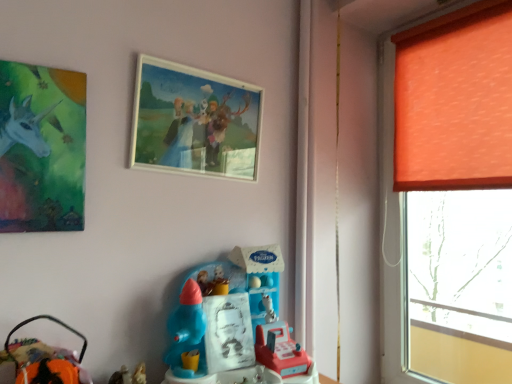
Consider the image. How much space does plastic toy at center, placed as the second toy when sorted from left to right, occupy vertically?

It is 15.65 inches.

This screenshot has height=384, width=512. What do you see at coordinates (42, 148) in the screenshot? I see `matte green painting at upper left, placed as the 1th picture frame when sorted from front to back` at bounding box center [42, 148].

You are a GUI agent. You are given a task and a screenshot of the screen. Output one action in this format:
    pyautogui.click(x=<x>, y=<y>)
    Task: Click on the velvet orange plush at lower left, which appears as the 1th toy when viewed from the left
    The height and width of the screenshot is (384, 512).
    Given the screenshot: What is the action you would take?
    pyautogui.click(x=42, y=359)

The width and height of the screenshot is (512, 384). Describe the element at coordinates (42, 359) in the screenshot. I see `velvet orange plush at lower left, which appears as the 1th toy when viewed from the left` at that location.

Describe the element at coordinates (195, 121) in the screenshot. This screenshot has height=384, width=512. I see `wooden picture frame at upper center, placed as the first picture frame when sorted from right to left` at that location.

This screenshot has height=384, width=512. Describe the element at coordinates (455, 101) in the screenshot. I see `orange fabric curtain at right` at that location.

In order to click on plastic toy at center, placed as the second toy when sorted from left to right in this screenshot , I will do `click(236, 325)`.

From the image's perspective, which is below, orange fabric window at right or plastic toy at center, marked as the 1th toy in a right-to-left arrangement?

plastic toy at center, marked as the 1th toy in a right-to-left arrangement, is shown below in the image.

Considering the relative sizes of orange fabric window at right and plastic toy at center, placed as the second toy when sorted from left to right, in the image provided, is orange fabric window at right shorter than plastic toy at center, placed as the second toy when sorted from left to right,?

No, orange fabric window at right is not shorter than plastic toy at center, placed as the second toy when sorted from left to right.

Is plastic toy at center, placed as the second toy when sorted from left to right, inside orange fabric window at right?

Actually, plastic toy at center, placed as the second toy when sorted from left to right, is outside orange fabric window at right.

Does point (424, 304) come behind point (253, 336)?

Yes.

From the picture: Is matte green painting at upper left, which is counted as the 2th picture frame, starting from the right, located within wooden picture frame at upper center, the second picture frame from the left?

No.

Which is more distant, [229,134] or [41,147]?

Positioned behind is point [229,134].

How many degrees apart are the facing directions of wooden picture frame at upper center, the second picture frame from the left, and matte green painting at upper left, which is counted as the 2th picture frame, starting from the right?

The facing directions of wooden picture frame at upper center, the second picture frame from the left, and matte green painting at upper left, which is counted as the 2th picture frame, starting from the right, are 0.0136 degrees apart.

Between wooden picture frame at upper center, the second picture frame from the left, and matte green painting at upper left, the first picture frame viewed from the left, which one has smaller width?

matte green painting at upper left, the first picture frame viewed from the left.

Which object is closer to the camera taking this photo, matte green painting at upper left, which is counted as the 2th picture frame, starting from the right, or orange fabric window at right?

Positioned in front is matte green painting at upper left, which is counted as the 2th picture frame, starting from the right.

From the image's perspective, is matte green painting at upper left, which is counted as the 2th picture frame, starting from the right, below orange fabric window at right?

No, from the image's perspective, matte green painting at upper left, which is counted as the 2th picture frame, starting from the right, is not below orange fabric window at right.

Based on the photo, is matte green painting at upper left, placed as the 1th picture frame when sorted from front to back, wider than orange fabric window at right?

No.

Is matte green painting at upper left, which is counted as the 2th picture frame, starting from the right, not close to orange fabric window at right?

matte green painting at upper left, which is counted as the 2th picture frame, starting from the right, is positioned a significant distance from orange fabric window at right.

Looking at the image, does orange fabric curtain at right seem bigger or smaller compared to velvet orange plush at lower left, which appears as the 1th toy when viewed from the left?

In the image, orange fabric curtain at right appears to be larger than velvet orange plush at lower left, which appears as the 1th toy when viewed from the left.

From the image's perspective, which is below, orange fabric curtain at right or velvet orange plush at lower left, which appears as the 1th toy when viewed from the left?

velvet orange plush at lower left, which appears as the 1th toy when viewed from the left, from the image's perspective.

Considering the sizes of objects orange fabric curtain at right and velvet orange plush at lower left, which appears as the 1th toy when viewed from the left, in the image provided, who is taller, orange fabric curtain at right or velvet orange plush at lower left, which appears as the 1th toy when viewed from the left,?

orange fabric curtain at right.

Can you confirm if orange fabric curtain at right is wider than velvet orange plush at lower left, which appears as the 1th toy when viewed from the left?

Incorrect, the width of orange fabric curtain at right does not surpass that of velvet orange plush at lower left, which appears as the 1th toy when viewed from the left.

Considering the sizes of plastic toy at center, placed as the second toy when sorted from left to right, and matte green painting at upper left, arranged as the 2th picture frame when viewed from the back, in the image, is plastic toy at center, placed as the second toy when sorted from left to right, taller or shorter than matte green painting at upper left, arranged as the 2th picture frame when viewed from the back,?

plastic toy at center, placed as the second toy when sorted from left to right, is shorter than matte green painting at upper left, arranged as the 2th picture frame when viewed from the back.

From a real-world perspective, is plastic toy at center, marked as the 1th toy in a right-to-left arrangement, over matte green painting at upper left, the first picture frame viewed from the left?

No, from a real-world perspective, plastic toy at center, marked as the 1th toy in a right-to-left arrangement, is not over matte green painting at upper left, the first picture frame viewed from the left

Visually, is plastic toy at center, marked as the 1th toy in a right-to-left arrangement, positioned to the left or to the right of matte green painting at upper left, arranged as the 2th picture frame when viewed from the back?

Based on their positions, plastic toy at center, marked as the 1th toy in a right-to-left arrangement, is located to the right of matte green painting at upper left, arranged as the 2th picture frame when viewed from the back.

Are plastic toy at center, placed as the second toy when sorted from left to right, and matte green painting at upper left, which is counted as the 2th picture frame, starting from the right, beside each other?

No, plastic toy at center, placed as the second toy when sorted from left to right, is not touching matte green painting at upper left, which is counted as the 2th picture frame, starting from the right.

Is matte green painting at upper left, placed as the 1th picture frame when sorted from front to back, behind velvet orange plush at lower left, which appears as the 1th toy when viewed from the left?

No.

In order to click on picture frame on the left of velvet orange plush at lower left, positioned as the 2th toy in right-to-left order in this screenshot , I will do `click(42, 148)`.

Does matte green painting at upper left, the first picture frame viewed from the left, turn towards velvet orange plush at lower left, which appears as the 1th toy when viewed from the left?

No, matte green painting at upper left, the first picture frame viewed from the left, is not aimed at velvet orange plush at lower left, which appears as the 1th toy when viewed from the left.

Are matte green painting at upper left, the first picture frame viewed from the left, and velvet orange plush at lower left, which appears as the 1th toy when viewed from the left, far apart?

No, matte green painting at upper left, the first picture frame viewed from the left, is not far away from velvet orange plush at lower left, which appears as the 1th toy when viewed from the left.

Which is more to the right, orange fabric curtain at right or orange fabric window at right?

orange fabric curtain at right.

Where is `window that is under the orange fabric curtain at right (from a real-world perspective)`? window that is under the orange fabric curtain at right (from a real-world perspective) is located at coordinates (455, 192).

From a real-world perspective, which object stands above the other?

From a 3D spatial view, orange fabric curtain at right is above.

Looking at their sizes, would you say orange fabric curtain at right is wider or thinner than orange fabric window at right?

Clearly, orange fabric curtain at right has less width compared to orange fabric window at right.

Image resolution: width=512 pixels, height=384 pixels. Identify the location of window behind the plastic toy at center, placed as the second toy when sorted from left to right. (455, 192).

This screenshot has height=384, width=512. I want to click on picture frame that appears below the wooden picture frame at upper center, placed as the first picture frame when sorted from right to left (from a real-world perspective), so click(x=42, y=148).

Estimate the real-world distances between objects in this image. Which object is further from velvet orange plush at lower left, which appears as the 1th toy when viewed from the left, orange fabric curtain at right or orange fabric window at right?

orange fabric window at right.

Which object lies nearer to the anchor point orange fabric curtain at right, wooden picture frame at upper center, which ranks as the second picture frame in front-to-back order, or plastic toy at center, marked as the 1th toy in a right-to-left arrangement?

Based on the image, wooden picture frame at upper center, which ranks as the second picture frame in front-to-back order, appears to be nearer to orange fabric curtain at right.

Estimate the real-world distances between objects in this image. Which object is further from orange fabric window at right, matte green painting at upper left, arranged as the 2th picture frame when viewed from the back, or wooden picture frame at upper center, which ranks as the second picture frame in front-to-back order?

matte green painting at upper left, arranged as the 2th picture frame when viewed from the back, is further to orange fabric window at right.

Estimate the real-world distances between objects in this image. Which object is further from wooden picture frame at upper center, acting as the first picture frame starting from the back, orange fabric window at right or orange fabric curtain at right?

orange fabric window at right.

From the image, which object appears to be farther from orange fabric curtain at right, wooden picture frame at upper center, which ranks as the second picture frame in front-to-back order, or velvet orange plush at lower left, which appears as the 1th toy when viewed from the left?

Among the two, velvet orange plush at lower left, which appears as the 1th toy when viewed from the left, is located further to orange fabric curtain at right.

When comparing their distances from plastic toy at center, marked as the 1th toy in a right-to-left arrangement, does velvet orange plush at lower left, which appears as the 1th toy when viewed from the left, or orange fabric curtain at right seem closer?

velvet orange plush at lower left, which appears as the 1th toy when viewed from the left, is positioned closer to the anchor plastic toy at center, marked as the 1th toy in a right-to-left arrangement.

From the image, which object appears to be farther from matte green painting at upper left, placed as the 1th picture frame when sorted from front to back, wooden picture frame at upper center, acting as the first picture frame starting from the back, or orange fabric window at right?

Among the two, orange fabric window at right is located further to matte green painting at upper left, placed as the 1th picture frame when sorted from front to back.

Based on their spatial positions, is orange fabric curtain at right or wooden picture frame at upper center, which ranks as the second picture frame in front-to-back order, further from plastic toy at center, placed as the second toy when sorted from left to right?

orange fabric curtain at right is positioned further to the anchor plastic toy at center, placed as the second toy when sorted from left to right.

I want to click on window located between plastic toy at center, marked as the 1th toy in a right-to-left arrangement, and orange fabric curtain at right in the left-right direction, so click(x=455, y=192).

Locate an element on the screen. The width and height of the screenshot is (512, 384). window between velvet orange plush at lower left, which appears as the 1th toy when viewed from the left, and orange fabric curtain at right from left to right is located at coordinates (455, 192).

Identify the location of toy between velvet orange plush at lower left, positioned as the 2th toy in right-to-left order, and orange fabric curtain at right from left to right. The image size is (512, 384). (236, 325).

At what (x,y) coordinates should I click in order to perform the action: click on toy between wooden picture frame at upper center, the second picture frame from the left, and orange fabric curtain at right from left to right. Please return your answer as a coordinate pair (x, y). The image size is (512, 384). Looking at the image, I should click on pos(236,325).